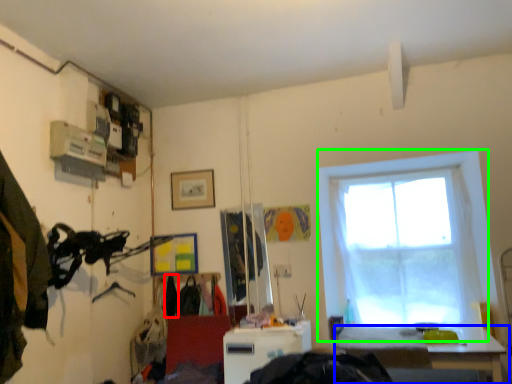
Question: Estimate the real-world distances between objects in this image. Which object is farther from clothing (highlighted by a red box), table (highlighted by a blue box) or window (highlighted by a green box)?

Choices:
 (A) table
 (B) window

Answer: (B)